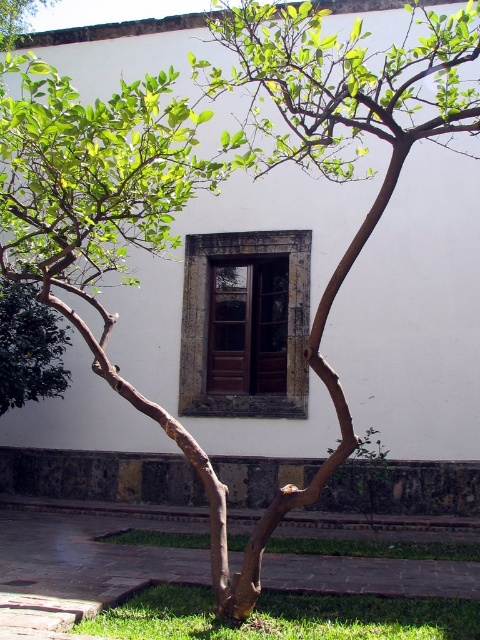
Can you confirm if brown wooden window at center is positioned below green leafy tree at lower left?

→ Incorrect, brown wooden window at center is not positioned below green leafy tree at lower left.

Based on the photo, does brown wooden window at center have a lesser height compared to green leafy tree at lower left?

No, brown wooden window at center is not shorter than green leafy tree at lower left.

At what (x,y) coordinates should I click in order to perform the action: click on brown wooden window at center. Please return your answer as a coordinate pair (x, y). The image size is (480, 640). Looking at the image, I should click on (244, 324).

The image size is (480, 640). I want to click on brown wooden window at center, so click(x=244, y=324).

Between point (300, 289) and point (31, 13), which one is positioned in front?

Point (300, 289)

Between brown wooden window at center and green leafy tree at center, which one appears on the left side from the viewer's perspective?

green leafy tree at center

Which is in front, point (305, 380) or point (12, 20)?

Point (305, 380) is more forward.

Identify the location of brown wooden window at center. (244, 324).

Is green leafy tree at lower left below green leafy tree at center?

Yes, green leafy tree at lower left is below green leafy tree at center.

At what (x,y) coordinates should I click in order to perform the action: click on green leafy tree at lower left. Please return your answer as a coordinate pair (x, y). Looking at the image, I should click on (29, 348).

Where is `green leafy tree at lower left`? This screenshot has width=480, height=640. green leafy tree at lower left is located at coordinates (29, 348).

At what (x,y) coordinates should I click in order to perform the action: click on green leafy tree at lower left. Please return your answer as a coordinate pair (x, y). The image size is (480, 640). Looking at the image, I should click on (29, 348).